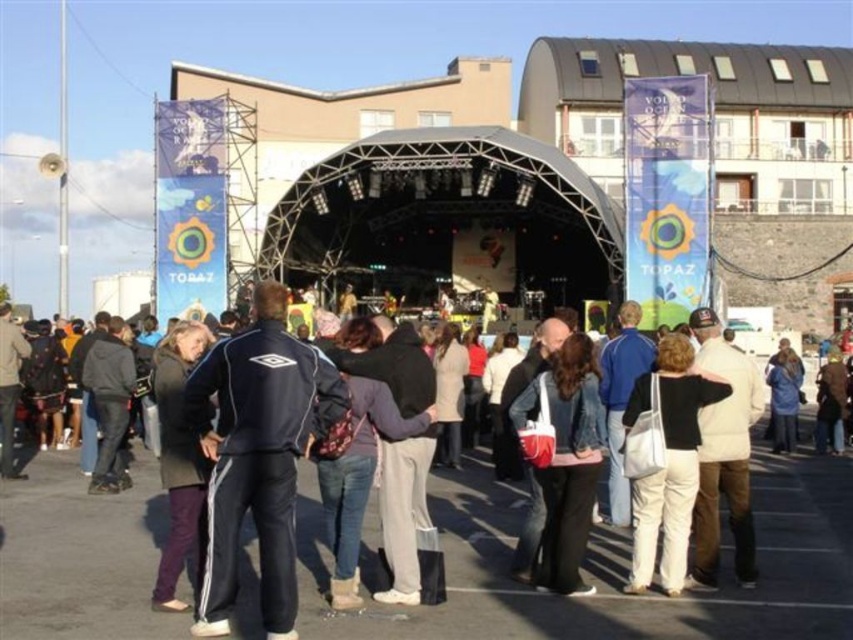
Who is positioned more to the right, denim jacket at center or white fabric bag at center?

white fabric bag at center is more to the right.

Which is above, denim jacket at center or white fabric bag at center?

Positioned higher is denim jacket at center.

Is point (566, 570) less distant than point (682, 529)?

Yes.

Locate an element on the screen. The image size is (853, 640). denim jacket at center is located at coordinates (566, 460).

The image size is (853, 640). What do you see at coordinates (566, 460) in the screenshot?
I see `denim jacket at center` at bounding box center [566, 460].

Is point (567, 436) closer to viewer compared to point (196, 440)?

No.

Image resolution: width=853 pixels, height=640 pixels. What are the coordinates of `denim jacket at center` in the screenshot? It's located at (566, 460).

Does dark blue track pants at center appear on the left side of black track suit at center?

No, dark blue track pants at center is not to the left of black track suit at center.

Locate an element on the screen. dark blue track pants at center is located at coordinates (x=601, y=568).

Image resolution: width=853 pixels, height=640 pixels. I want to click on dark blue track pants at center, so click(x=601, y=568).